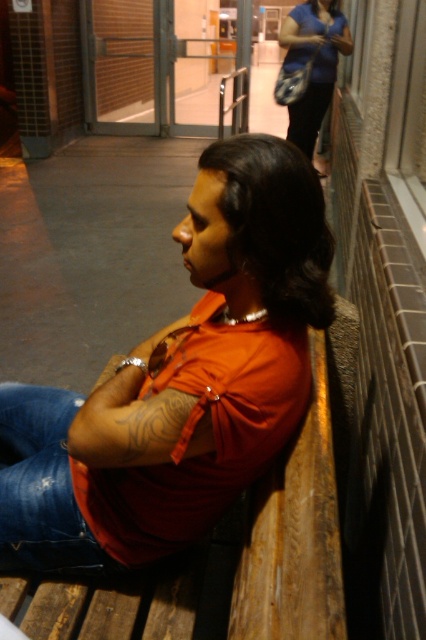
Question: Observing the image, what is the correct spatial positioning of matte orange shirt at center in reference to blue denim jeans at lower left?

Choices:
 (A) right
 (B) left

Answer: (A)

Question: Can you confirm if matte orange shirt at center is bigger than blue denim jeans at lower left?

Choices:
 (A) yes
 (B) no

Answer: (A)

Question: Which of the following is the closest to the observer?

Choices:
 (A) matte orange shirt at center
 (B) blue denim jeans at lower left

Answer: (A)

Question: Can you confirm if matte orange shirt at center is positioned above blue denim jeans at lower left?

Choices:
 (A) yes
 (B) no

Answer: (A)